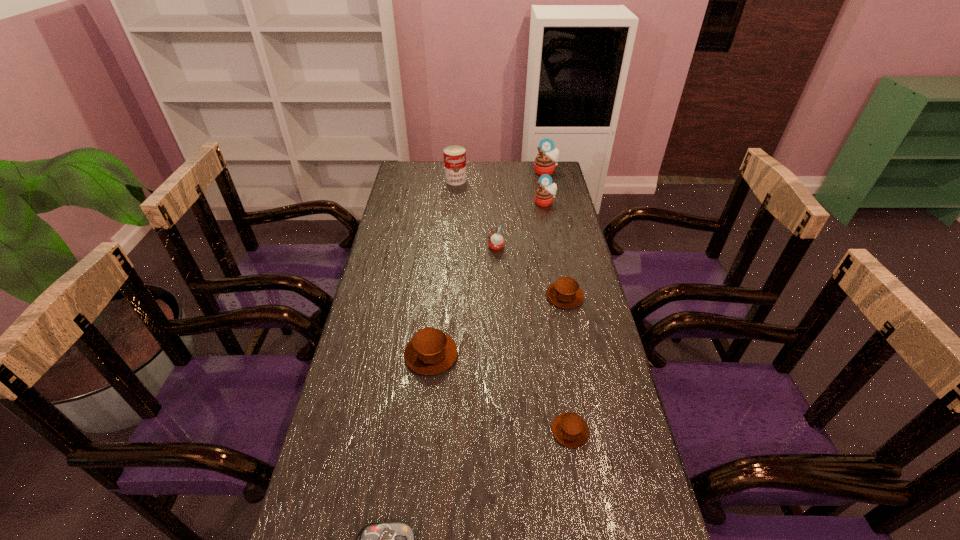
The height and width of the screenshot is (540, 960). Find the location of `free space that satisfies the following two spatial constraints: 1. on the front-facing side of the biggest pink muffin; 2. on the front-facing side of the fifth object from right to left`. free space that satisfies the following two spatial constraints: 1. on the front-facing side of the biggest pink muffin; 2. on the front-facing side of the fifth object from right to left is located at coordinates (563, 247).